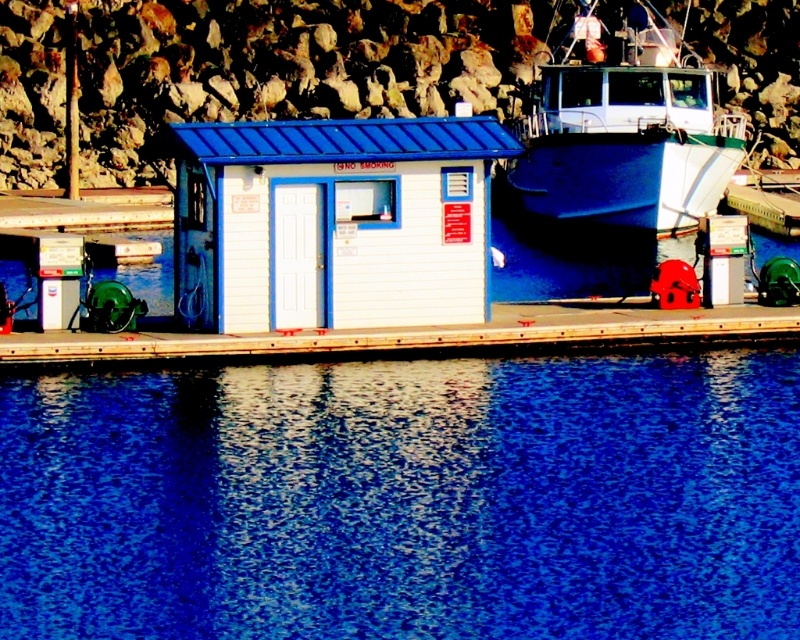
Can you confirm if white matte hut at center is taller than blue glossy boat at right?

No, white matte hut at center is not taller than blue glossy boat at right.

Does white matte hut at center appear under blue glossy boat at right?

Indeed, white matte hut at center is positioned under blue glossy boat at right.

Is point (312, 129) positioned in front of point (544, 81)?

Yes, point (312, 129) is closer to viewer.

Locate an element on the screen. Image resolution: width=800 pixels, height=640 pixels. white matte hut at center is located at coordinates (334, 221).

Between blue liquid water at lower center and blue glossy boat at right, which one has more height?

Standing taller between the two is blue glossy boat at right.

Is point (214, 454) behind point (684, 74)?

No, (214, 454) is closer to viewer.

Locate an element on the screen. blue liquid water at lower center is located at coordinates pyautogui.click(x=405, y=499).

Locate an element on the screen. This screenshot has height=640, width=800. blue liquid water at lower center is located at coordinates (405, 499).

Between point (196, 556) and point (258, 163), which one is positioned behind?

Point (258, 163)

Is blue liquid water at lower center to the right of white matte hut at center from the viewer's perspective?

Incorrect, blue liquid water at lower center is not on the right side of white matte hut at center.

This screenshot has width=800, height=640. What do you see at coordinates (405, 499) in the screenshot? I see `blue liquid water at lower center` at bounding box center [405, 499].

You are a GUI agent. You are given a task and a screenshot of the screen. Output one action in this format:
    pyautogui.click(x=<x>, y=<y>)
    Task: Click on the blue liquid water at lower center
    The width and height of the screenshot is (800, 640).
    Given the screenshot: What is the action you would take?
    pyautogui.click(x=405, y=499)